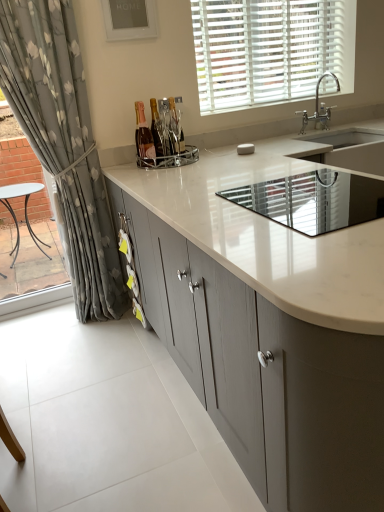
This screenshot has height=512, width=384. Identify the location of vacant area situated below white matte blinds at upper center (from a real-world perspective). (276, 103).